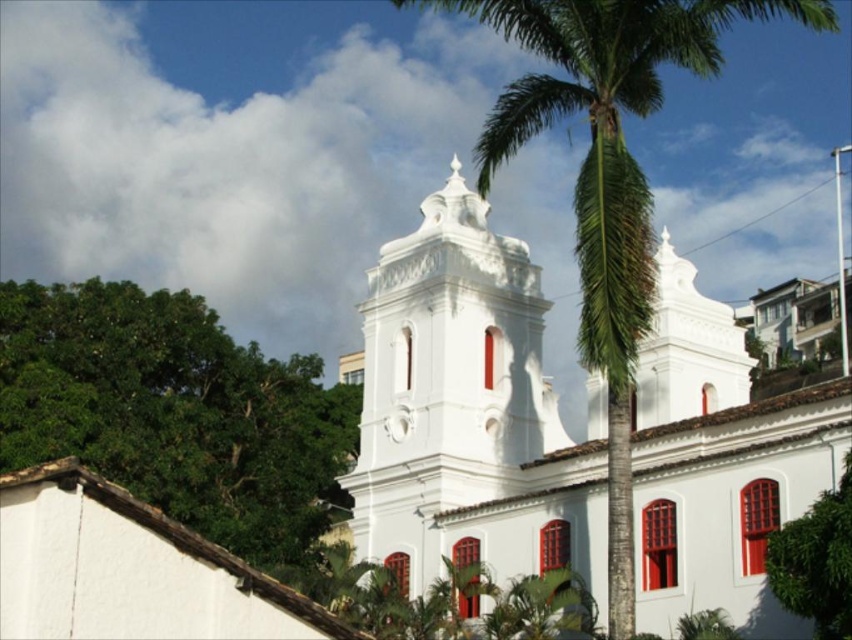
Can you confirm if green leafy tree at left is taller than green leafy palm tree at center?

Incorrect, green leafy tree at left's height is not larger of green leafy palm tree at center's.

In the scene shown: Does green leafy tree at left come in front of green leafy palm tree at center?

No.

Between point (234, 502) and point (792, 8), which one is positioned in front?

Point (792, 8) is in front.

The height and width of the screenshot is (640, 852). Identify the location of green leafy tree at left. click(x=174, y=412).

Does green leafy palm tree at center appear on the right side of green leafy tree at center?

Yes, green leafy palm tree at center is to the right of green leafy tree at center.

Is green leafy palm tree at center wider than green leafy tree at center?

Indeed, green leafy palm tree at center has a greater width compared to green leafy tree at center.

Is point (634, 310) positioned behind point (769, 564)?

Yes, point (634, 310) is behind point (769, 564).

Find the location of a particular element. green leafy palm tree at center is located at coordinates (609, 179).

Can you confirm if green leafy tree at left is positioned to the left of green leafy tree at center?

Correct, you'll find green leafy tree at left to the left of green leafy tree at center.

Which is above, green leafy tree at left or green leafy tree at center?

green leafy tree at left is above.

Where is `green leafy tree at left`? green leafy tree at left is located at coordinates (174, 412).